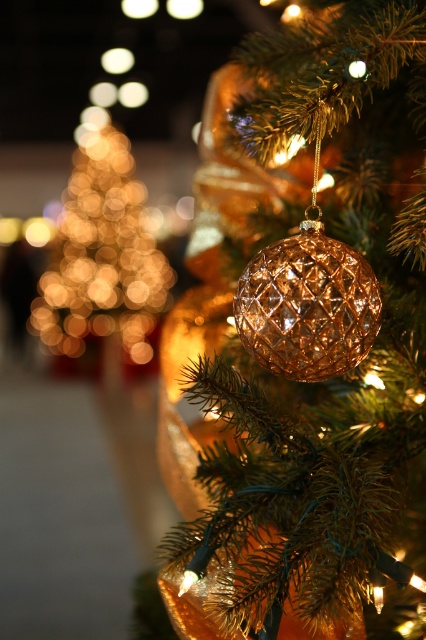
You are standing in front of the Christmas tree and want to hang a new ornament. The point you are aiming for is at coordinates point (299, 332). What object is located at that point?

The shiny gold ornament at center is located at point (299, 332).

You are standing in front of the Christmas tree and see two points marked on the image. Which point is closer to you, point [319,177] or point [342,244]?

Point [319,177] is closer to you because it is further to the viewer than point [342,244].

Looking at this image, you are setting up a Christmas display and want to place both the shiny gold ornament at center and the gold textured ball at center on a shelf. The shelf has a space that can only accommodate items up to the width of the narrower object. Which ornament should you choose to fit on the shelf?

The gold textured ball at center has a smaller width than the shiny gold ornament at center, so you should choose the gold textured ball at center to fit on the shelf.